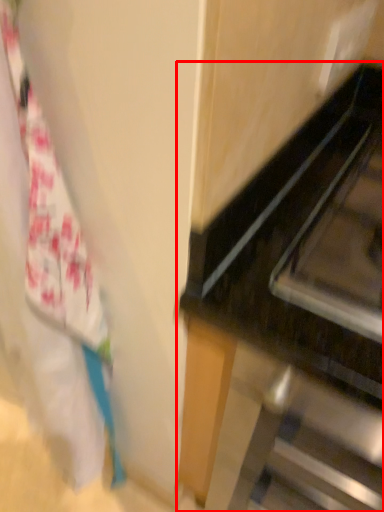
Question: From the image's perspective, what is the correct spatial positioning of furniture (annotated by the red box) in reference to laundry?

Choices:
 (A) above
 (B) below

Answer: (B)